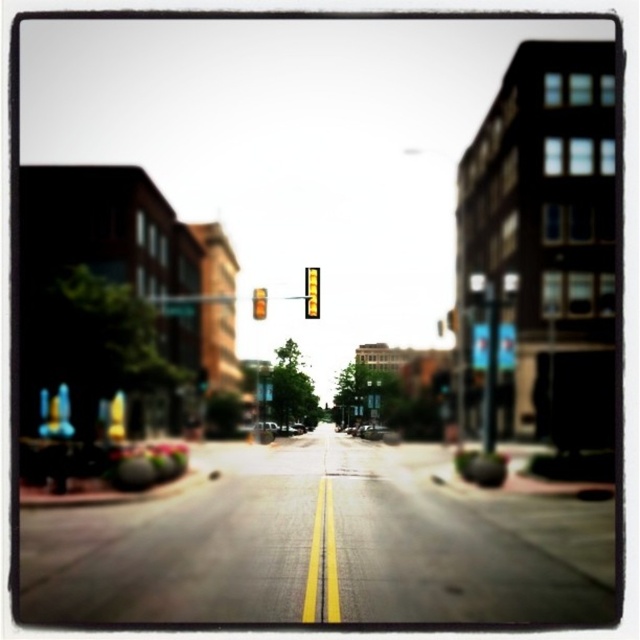
Looking at this image, is the position of metallic pole at center-right more distant than that of metallic silver car at center?

No.

Between metallic pole at center-right and metallic silver car at center, which one appears on the left side from the viewer's perspective?

metallic silver car at center

Image resolution: width=640 pixels, height=640 pixels. In order to click on metallic pole at center-right in this screenshot , I will do `click(490, 365)`.

This screenshot has width=640, height=640. I want to click on metallic pole at center-right, so click(490, 365).

Between blue reflective sign at center and yellow matte traffic light at center, which one is positioned higher?

yellow matte traffic light at center is higher up.

Who is taller, blue reflective sign at center or yellow matte traffic light at center?

Standing taller between the two is blue reflective sign at center.

Measure the distance between blue reflective sign at center and camera.

blue reflective sign at center is 39.60 meters from camera.

You are a GUI agent. You are given a task and a screenshot of the screen. Output one action in this format:
    pyautogui.click(x=<x>, y=<y>)
    Task: Click on the blue reflective sign at center
    
    Given the screenshot: What is the action you would take?
    pyautogui.click(x=506, y=346)

Can you confirm if amber glass traffic light at center is positioned above metallic silver car at center?

Indeed, amber glass traffic light at center is positioned over metallic silver car at center.

Is point (259, 296) more distant than point (266, 420)?

No, it is in front of (266, 420).

Which is behind, point (259, 308) or point (269, 422)?

Point (269, 422)

At what (x,y) coordinates should I click in order to perform the action: click on amber glass traffic light at center. Please return your answer as a coordinate pair (x, y). The image size is (640, 640). Looking at the image, I should click on (259, 301).